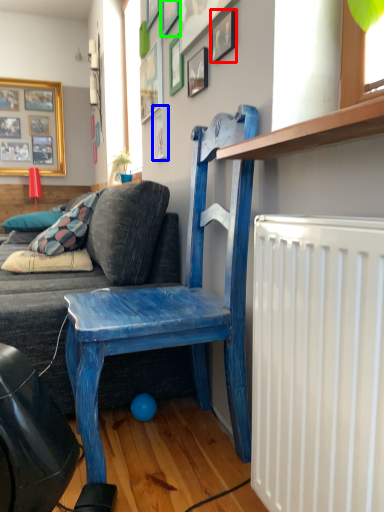
Question: Which object is positioned farthest from picture frame (highlighted by a red box)? Select from picture frame (highlighted by a blue box) and picture frame (highlighted by a green box).

Choices:
 (A) picture frame
 (B) picture frame

Answer: (A)